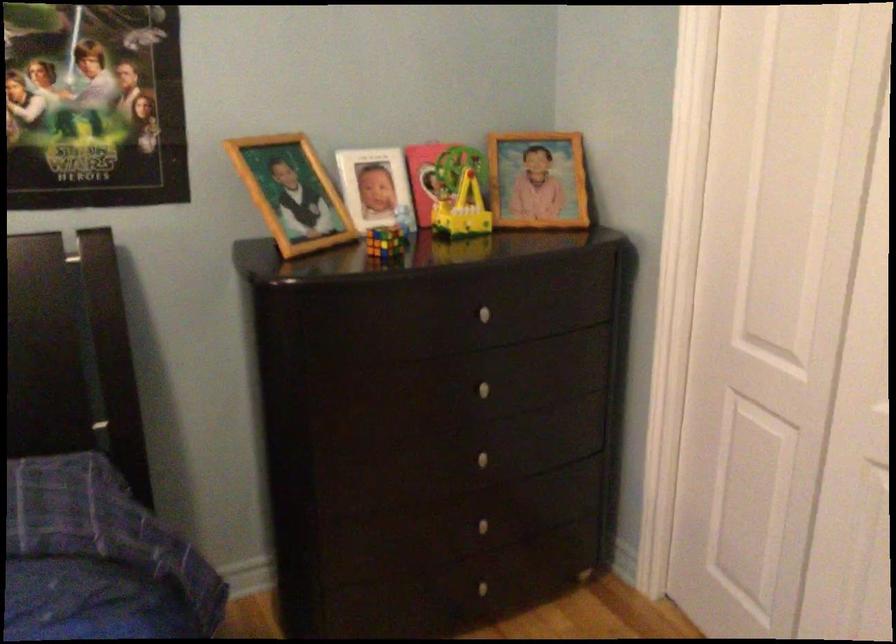
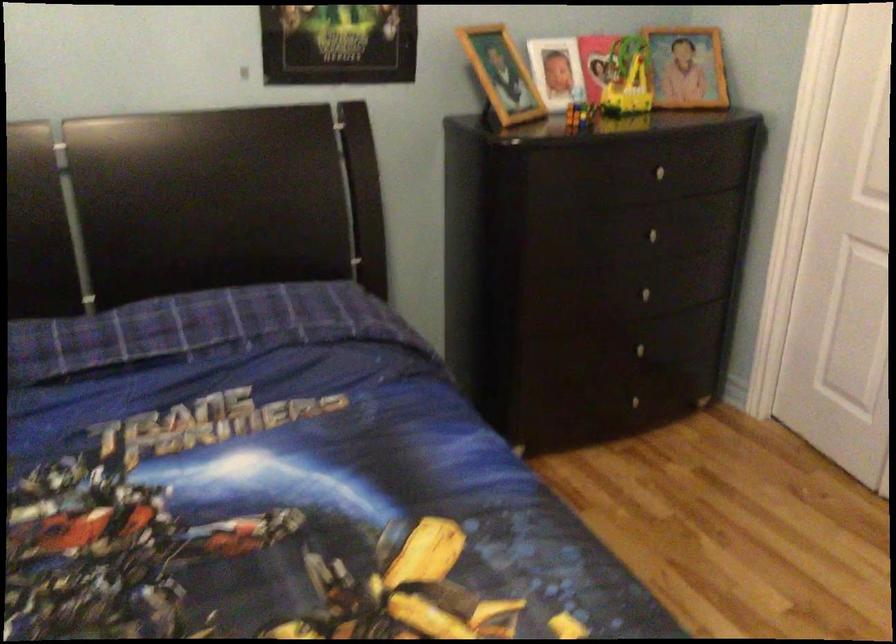
Question: How did the camera likely rotate?

Choices:
 (A) Left
 (B) Right
 (C) Up
 (D) Down

Answer: (D)